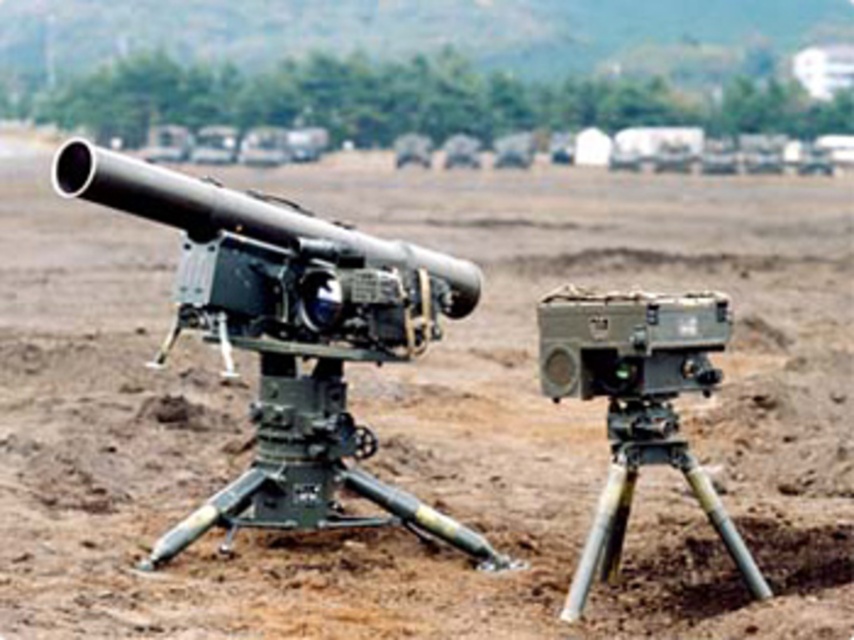
Question: Is matte black cannon at center bigger than matte gray video camera at center?

Choices:
 (A) no
 (B) yes

Answer: (B)

Question: Does matte black cannon at center have a smaller size compared to matte gray video camera at center?

Choices:
 (A) yes
 (B) no

Answer: (B)

Question: Can you confirm if matte black cannon at center is bigger than matte gray video camera at center?

Choices:
 (A) no
 (B) yes

Answer: (B)

Question: Which object appears closest to the camera in this image?

Choices:
 (A) matte gray video camera at center
 (B) matte black cannon at center

Answer: (A)